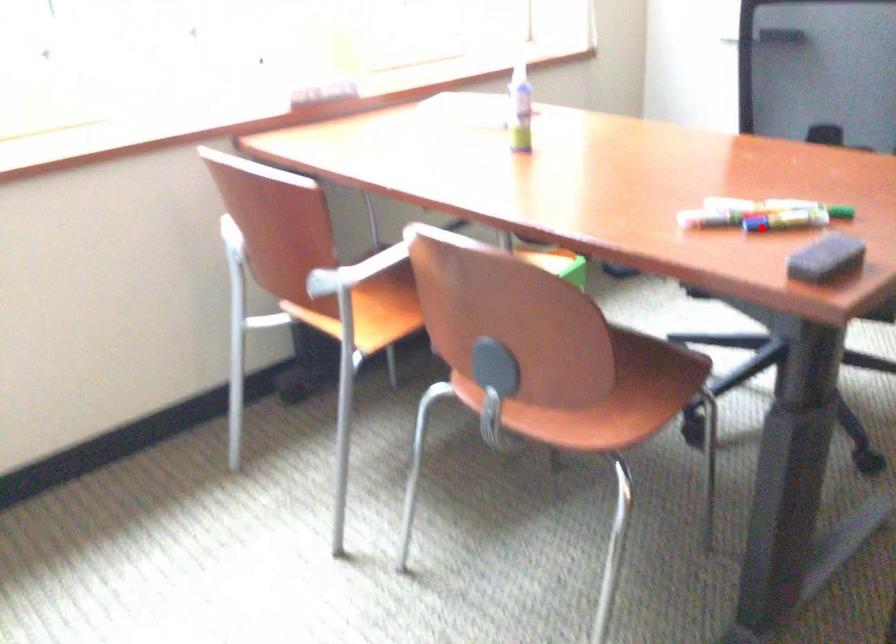
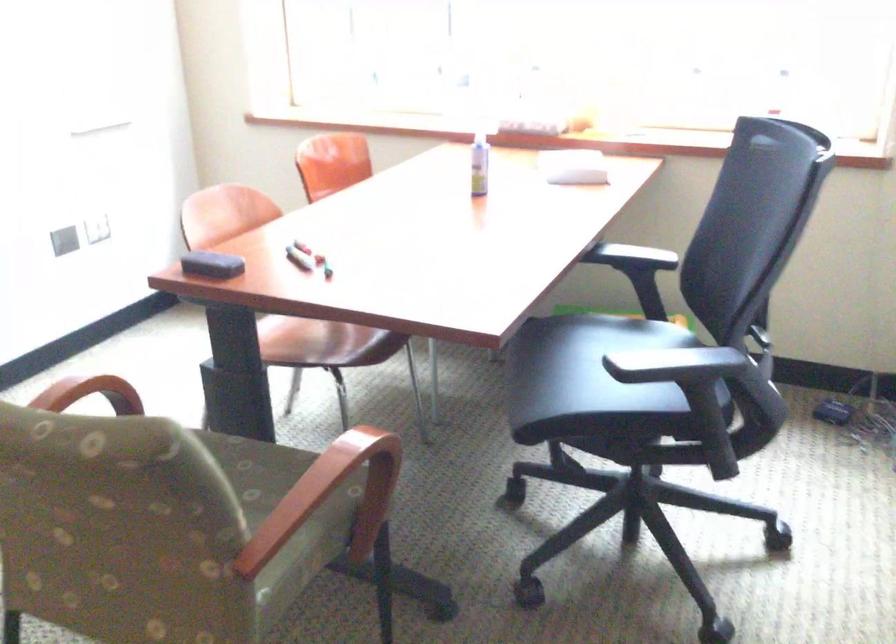
The point at the highlighted location is marked in the first image. Where is the corresponding point in the second image?

(299, 258)